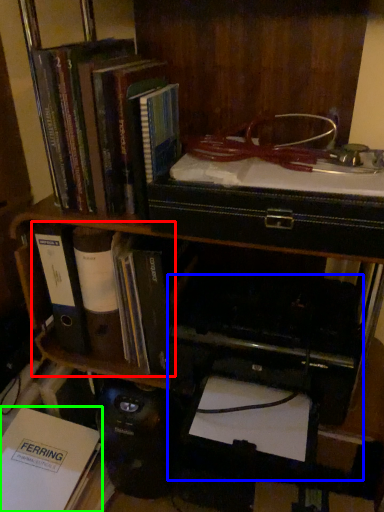
Question: Estimate the real-world distances between objects in this image. Which object is farther from book (highlighted by a red box), printer (highlighted by a blue box) or book (highlighted by a green box)?

Choices:
 (A) printer
 (B) book

Answer: (B)